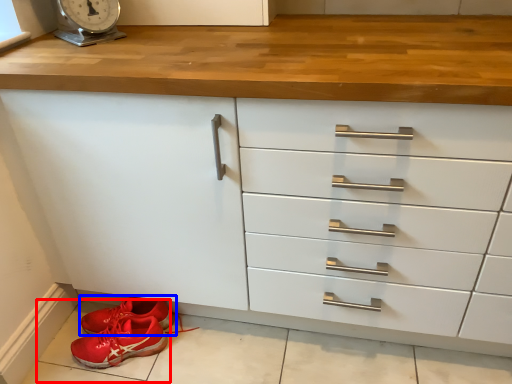
Question: Which point is further to the camera, tile (highlighted by a red box) or footwear (highlighted by a blue box)?

Choices:
 (A) tile
 (B) footwear

Answer: (B)